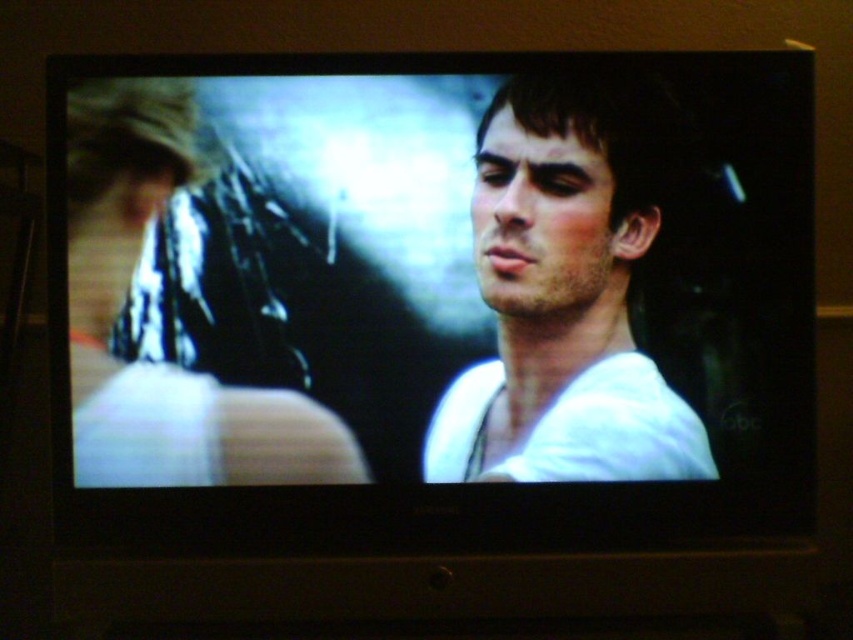
Question: Does white matte screen at center have a smaller size compared to white matte shirt at center?

Choices:
 (A) no
 (B) yes

Answer: (A)

Question: Is white matte screen at center to the right of white matte shirt at center from the viewer's perspective?

Choices:
 (A) no
 (B) yes

Answer: (A)

Question: Which of the following is the closest to the observer?

Choices:
 (A) (469, 472)
 (B) (517, 236)

Answer: (B)

Question: Which point is farther to the camera?

Choices:
 (A) (495, 376)
 (B) (425, 141)

Answer: (A)

Question: Which point is farther to the camera?

Choices:
 (A) (582, 308)
 (B) (685, 364)

Answer: (B)

Question: Can you confirm if white matte screen at center is positioned to the left of white matte shirt at center?

Choices:
 (A) no
 (B) yes

Answer: (B)